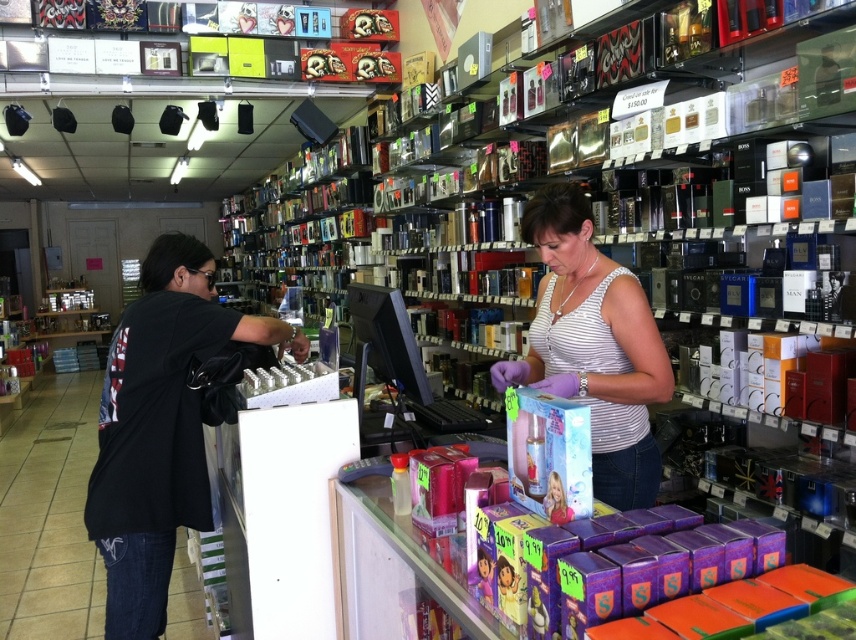
Question: Can you confirm if white striped tank top at center is bigger than black fabric shirt at left?

Choices:
 (A) yes
 (B) no

Answer: (A)

Question: In this image, where is white striped tank top at center located relative to black fabric shirt at left?

Choices:
 (A) below
 (B) above

Answer: (B)

Question: Which point is closer to the camera?

Choices:
 (A) black fabric shirt at left
 (B) white striped tank top at center

Answer: (B)

Question: Is white striped tank top at center bigger than black fabric shirt at left?

Choices:
 (A) yes
 (B) no

Answer: (A)